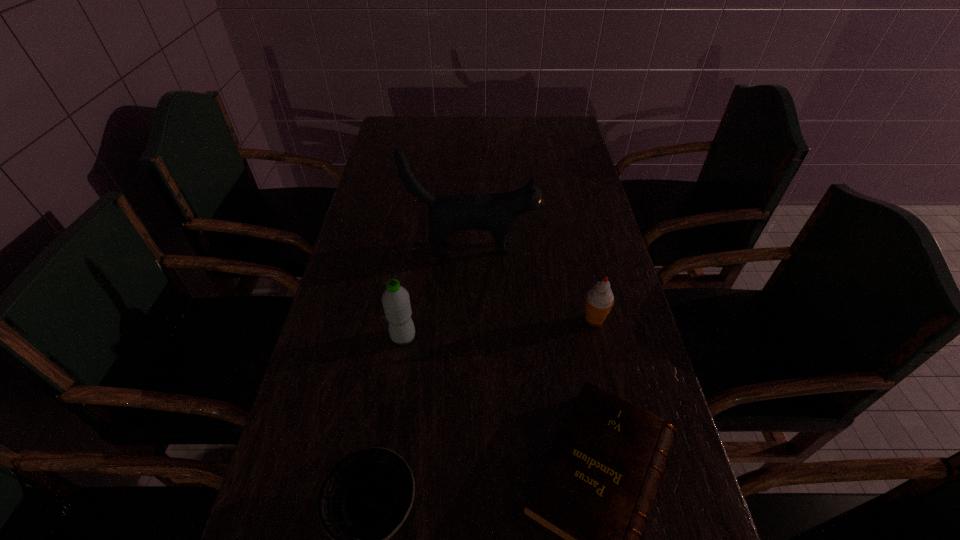
Locate an element on the screen. the farthest object is located at coordinates tap(497, 212).

Identify the location of the tallest object. (497, 212).

Image resolution: width=960 pixels, height=540 pixels. Identify the location of water bottle. (395, 299).

Find the location of a particular element. The image size is (960, 540). icecream is located at coordinates (599, 300).

At what (x,y) coordinates should I click in order to perform the action: click on vacant area located 0.060m at the face of the tallest object. Please return your answer as a coordinate pair (x, y). The height and width of the screenshot is (540, 960). Looking at the image, I should click on (560, 248).

I want to click on free space located on the back of the second tallest object, so click(418, 242).

Where is `vacant space situated 0.330m on the back of the icecream`? This screenshot has width=960, height=540. vacant space situated 0.330m on the back of the icecream is located at coordinates (571, 224).

Image resolution: width=960 pixels, height=540 pixels. In order to click on object at the left edge in this screenshot , I will do `click(395, 299)`.

The image size is (960, 540). I want to click on object present at the right edge, so click(599, 300).

Locate an element on the screen. This screenshot has height=540, width=960. free space at the far edge of the desktop is located at coordinates [498, 145].